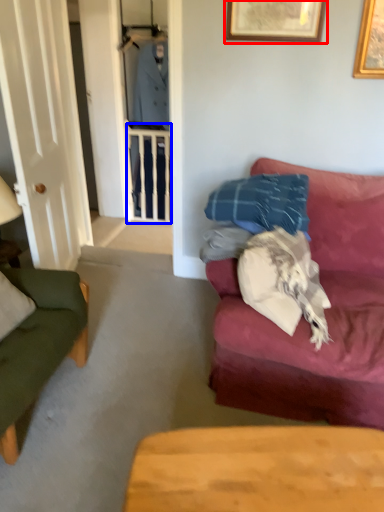
Question: Which point is further to the camera, picture frame (highlighted by a red box) or balustrade (highlighted by a blue box)?

Choices:
 (A) picture frame
 (B) balustrade

Answer: (B)